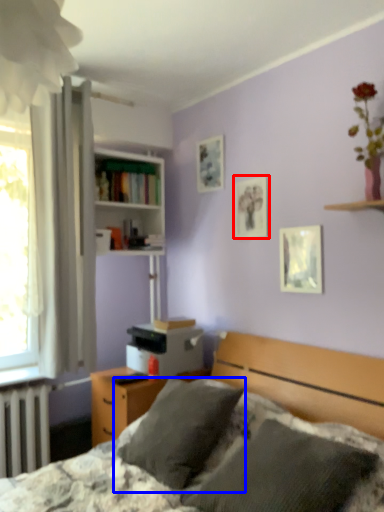
Question: Which object appears closest to the camera in this image, picture frame (highlighted by a red box) or pillow (highlighted by a blue box)?

Choices:
 (A) picture frame
 (B) pillow

Answer: (B)